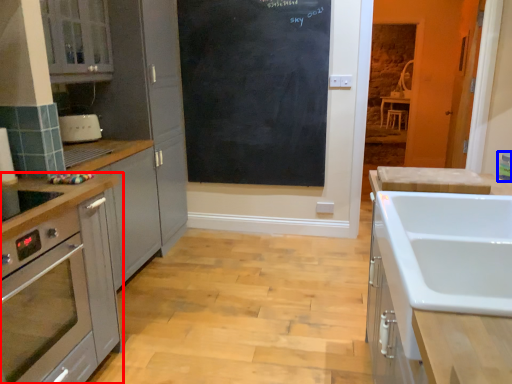
Question: Among these objects, which one is nearest to the camera, cabinetry (highlighted by a red box) or appliance (highlighted by a blue box)?

Choices:
 (A) cabinetry
 (B) appliance

Answer: (A)